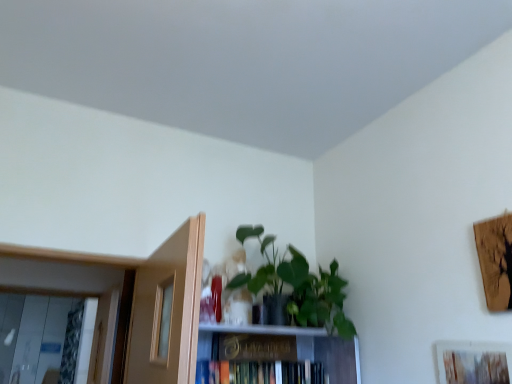
Locate an element on the screen. empty space that is ontop of gold metallic paperback book at center is located at coordinates (252, 335).